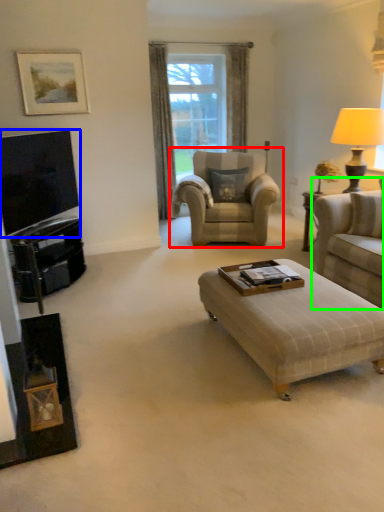
Question: Which is nearer to the chair (highlighted by a red box)? television (highlighted by a blue box) or studio couch (highlighted by a green box).

Choices:
 (A) television
 (B) studio couch

Answer: (B)